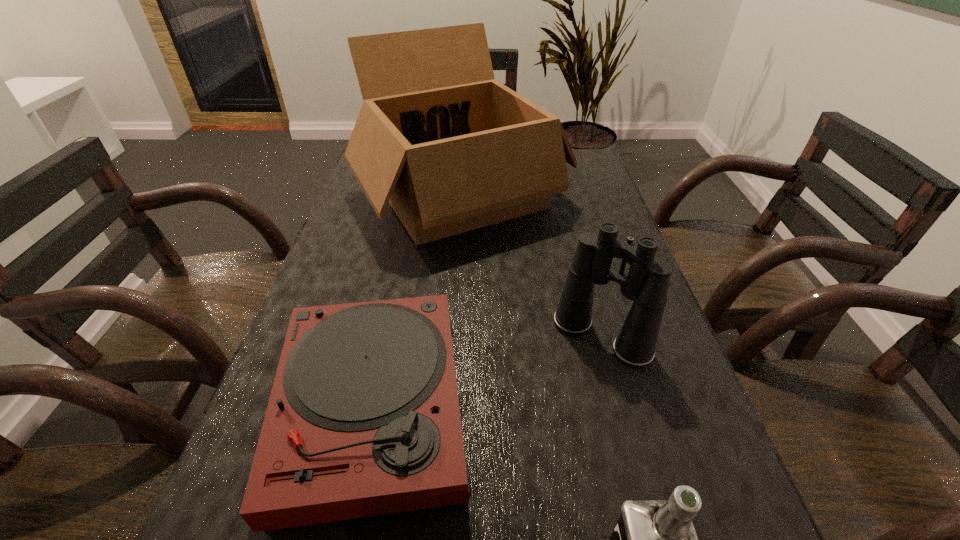
Where is `box at the right edge`? Image resolution: width=960 pixels, height=540 pixels. box at the right edge is located at coordinates (451, 149).

Find the location of a particular element. The width and height of the screenshot is (960, 540). binoculars located in the right edge section of the desktop is located at coordinates (647, 283).

Find the location of a particular element. This screenshot has height=540, width=960. object present at the far left corner is located at coordinates coord(451,149).

Locate an element on the screen. object that is at the far right corner is located at coordinates (451, 149).

In the image, there is a desktop. In order to click on vacant space at the left edge in this screenshot , I will do `click(365, 219)`.

Locate an element on the screen. This screenshot has height=540, width=960. blank space at the right edge of the desktop is located at coordinates (570, 224).

Locate an element on the screen. This screenshot has height=540, width=960. empty space that is in between the shortest object and the binoculars is located at coordinates (487, 372).

Where is `empty space that is in between the binoculars and the box`? empty space that is in between the binoculars and the box is located at coordinates (531, 267).

Identify the location of vacant space in between the binoculars and the record player. This screenshot has width=960, height=540. (487, 372).

You are a GUI agent. You are given a task and a screenshot of the screen. Output one action in this format:
    pyautogui.click(x=<x>, y=<y>)
    Task: Click on the empty location between the box and the binoculars
    The width and height of the screenshot is (960, 540).
    Given the screenshot: What is the action you would take?
    pyautogui.click(x=531, y=267)